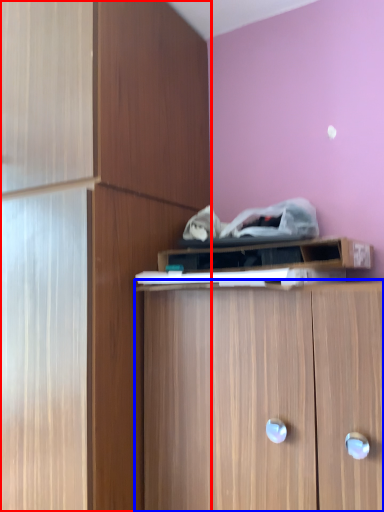
Question: Which of the following is the closest to the observer, cabinetry (highlighted by a red box) or cabinetry (highlighted by a blue box)?

Choices:
 (A) cabinetry
 (B) cabinetry

Answer: (B)